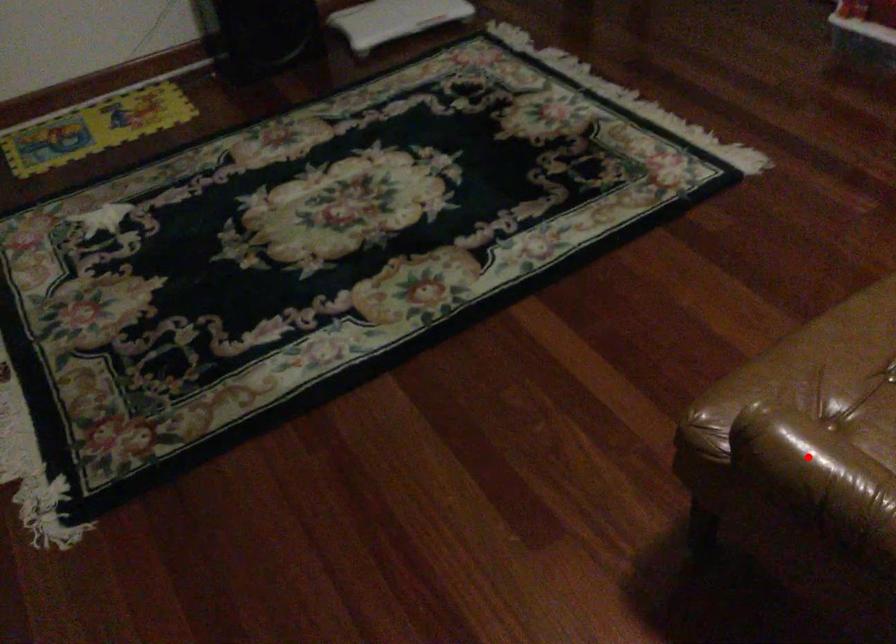
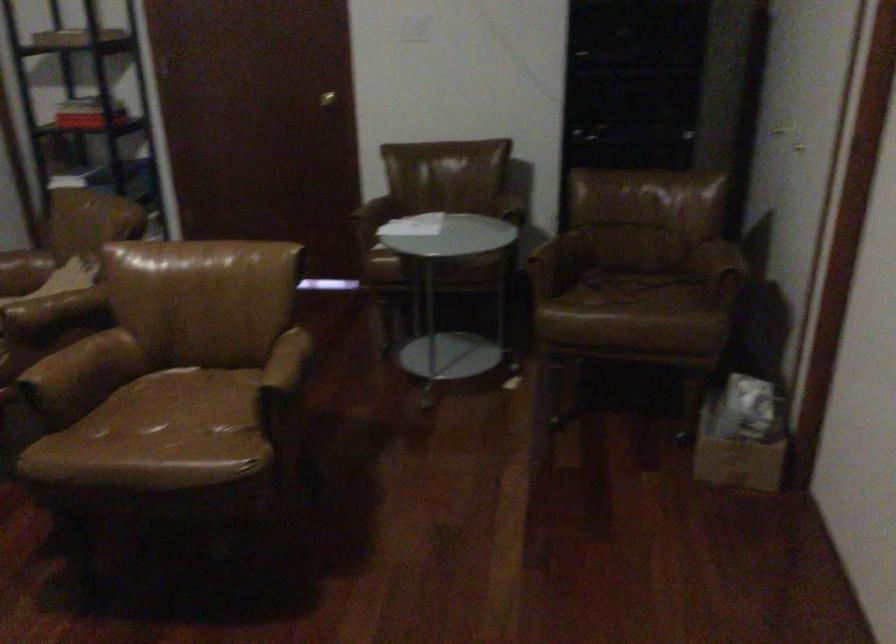
In the second image, find the point that corresponds to the highlighted location in the first image.

(283, 371)